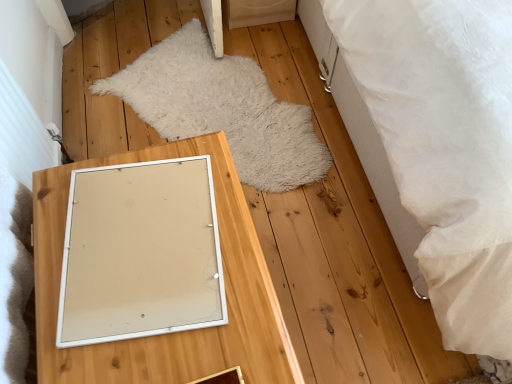
Question: From a real-world perspective, is white textured bed at right physically located above or below wooden mirror at center?

Choices:
 (A) below
 (B) above

Answer: (B)

Question: Considering the positions of white textured bed at right and wooden mirror at center in the image, is white textured bed at right wider or thinner than wooden mirror at center?

Choices:
 (A) wide
 (B) thin

Answer: (A)

Question: Which object is the closest to the wooden mirror at center?

Choices:
 (A) white matte picture frame at center
 (B) white fluffy rug at center
 (C) white textured bed at right

Answer: (A)

Question: Which of these objects is positioned farthest from the white fluffy rug at center?

Choices:
 (A) white textured bed at right
 (B) wooden mirror at center
 (C) white matte picture frame at center

Answer: (C)